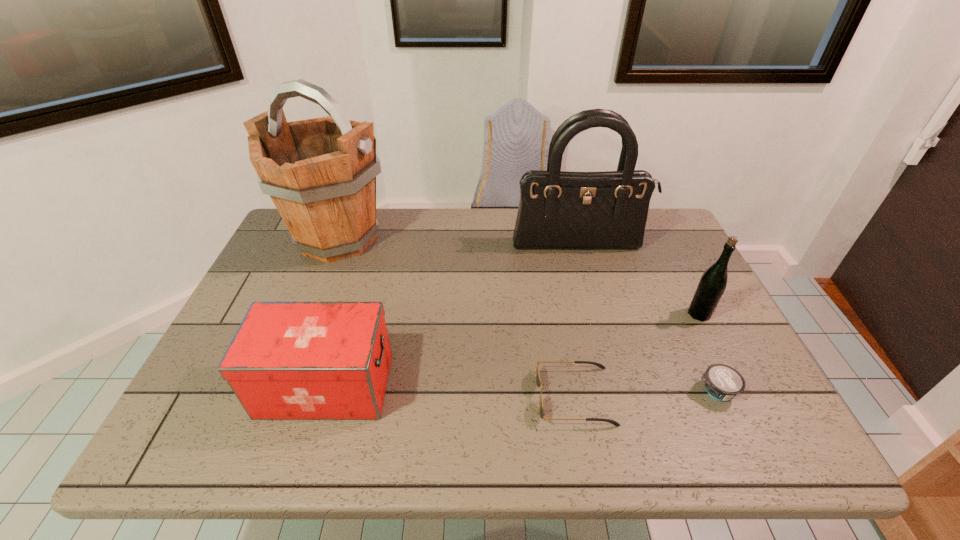
Identify the location of the first-aid kit located at the left edge. Image resolution: width=960 pixels, height=540 pixels. (288, 360).

Identify the location of handbag located at the right edge. (558, 210).

Where is `beer bottle present at the right edge`? beer bottle present at the right edge is located at coordinates (712, 284).

This screenshot has height=540, width=960. Identify the location of yogurt present at the right edge. (722, 382).

You are a GUI agent. You are given a task and a screenshot of the screen. Output one action in this format:
    pyautogui.click(x=<x>, y=<y>)
    Task: Click on the object that is positioned at the far left corner
    This screenshot has height=540, width=960.
    Given the screenshot: What is the action you would take?
    pyautogui.click(x=320, y=173)

You are a GUI agent. You are given a task and a screenshot of the screen. Output one action in this format:
    pyautogui.click(x=<x>, y=<y>)
    Task: Click on the object present at the near left corner
    
    Given the screenshot: What is the action you would take?
    pyautogui.click(x=288, y=360)

At what (x,y) coordinates should I click in order to perform the action: click on object positioned at the far right corner. Please return your answer as a coordinate pair (x, y). Looking at the image, I should click on (558, 210).

Image resolution: width=960 pixels, height=540 pixels. What are the coordinates of `vacant area at the far edge of the desktop` in the screenshot? It's located at (468, 234).

Image resolution: width=960 pixels, height=540 pixels. What are the coordinates of `vacant space at the near edge of the desktop` in the screenshot? It's located at (258, 436).

Image resolution: width=960 pixels, height=540 pixels. In the image, there is a desktop. Identify the location of free region at the left edge. (272, 292).